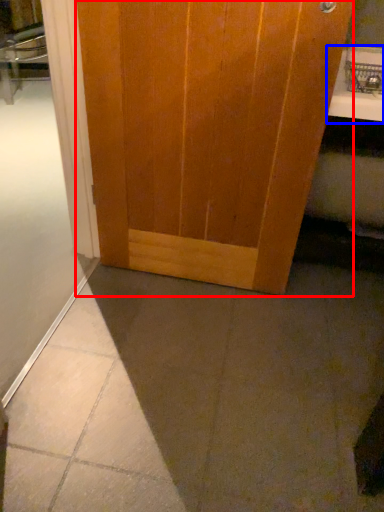
Question: Which of the following is the farthest to the observer, door (highlighted by a red box) or counter top (highlighted by a blue box)?

Choices:
 (A) door
 (B) counter top

Answer: (B)